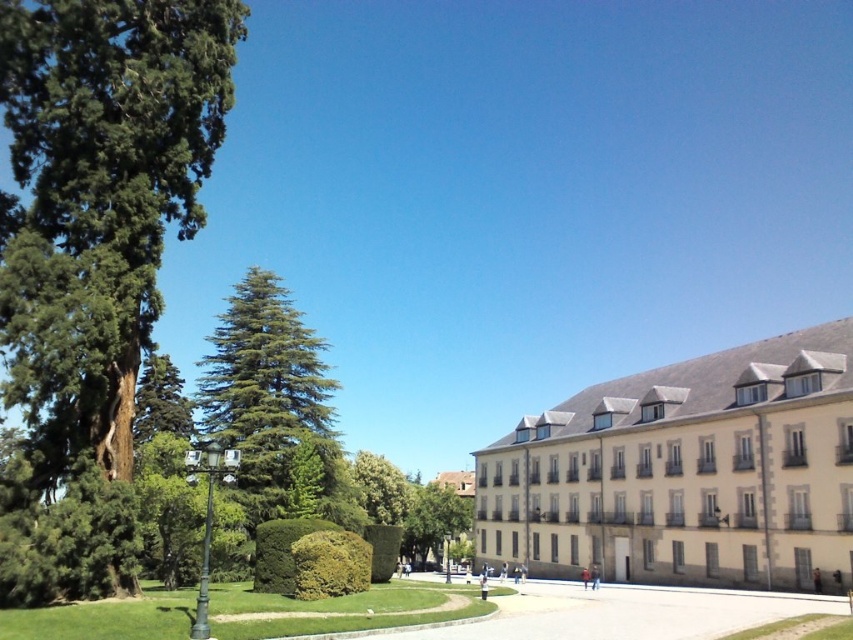
You are standing on the paved pathway and want to take a photo of both the green leafy hedge at center and the green leafy tree at center. Which one should you focus on first to ensure both are in the frame?

You should focus on the green leafy hedge at center first since it is in front of the green leafy tree at center, ensuring both are visible in the frame.

You are standing on the paved pathway and see both the green leafy hedge at center and the green leafy tree at center. Which one is located to the right of the other?

The green leafy hedge at center is positioned on the right side of the green leafy tree at center.